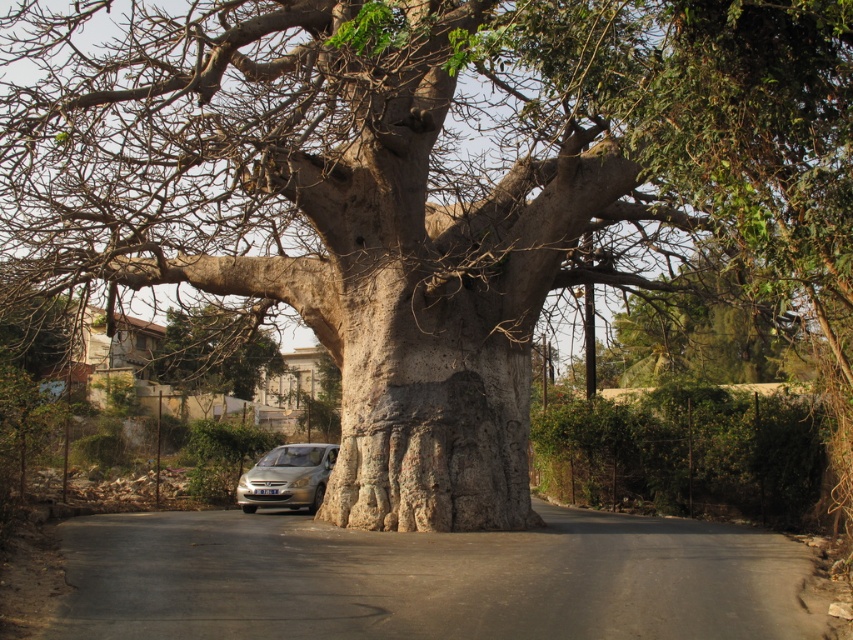
Question: Does green leafy tree at center have a greater width compared to silver metallic car at center?

Choices:
 (A) yes
 (B) no

Answer: (A)

Question: Which point is farther to the camera?

Choices:
 (A) silver metallic car at center
 (B) green leafy tree at center

Answer: (A)

Question: Which point is closer to the camera taking this photo?

Choices:
 (A) (312, 509)
 (B) (253, 348)

Answer: (A)

Question: Can you confirm if green leafy tree at center is wider than silver metallic car at center?

Choices:
 (A) no
 (B) yes

Answer: (B)

Question: Which of the following is the farthest from the observer?

Choices:
 (A) (289, 488)
 (B) (238, 387)

Answer: (B)

Question: Does green leafy tree at center appear on the right side of silver metallic car at center?

Choices:
 (A) no
 (B) yes

Answer: (A)